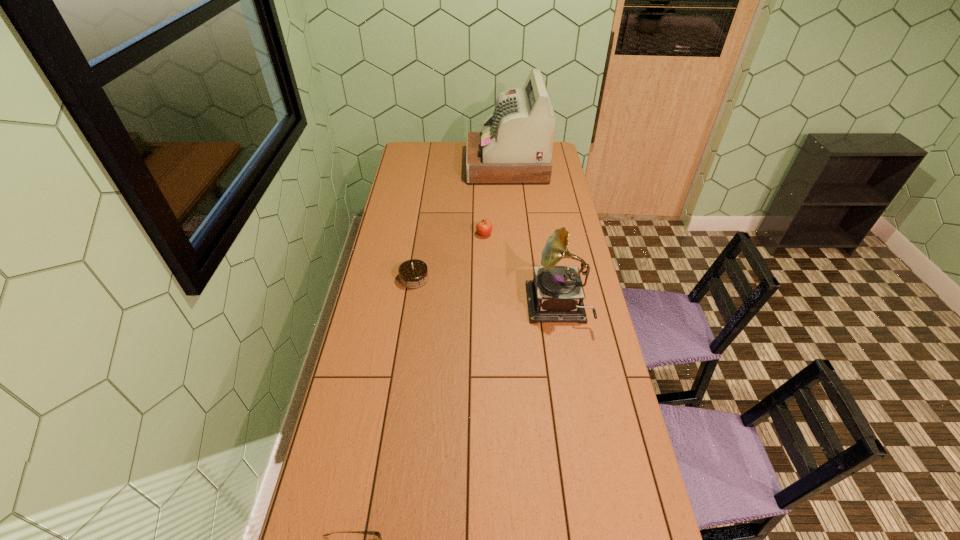
Where is `free space between the cash register and the second tallest object`? This screenshot has width=960, height=540. free space between the cash register and the second tallest object is located at coordinates (532, 237).

Locate an element on the screen. vacant area that lies between the chocolate cake and the tallest object is located at coordinates (461, 223).

This screenshot has height=540, width=960. I want to click on free space that is in between the record player and the chocolate cake, so click(486, 293).

Locate an element on the screen. This screenshot has width=960, height=540. empty space between the chocolate cake and the cash register is located at coordinates (461, 223).

Identify the location of vacant space that is in between the fourth shortest object and the apple. The height and width of the screenshot is (540, 960). (521, 271).

The width and height of the screenshot is (960, 540). What are the coordinates of `free area in between the second tallest object and the chocolate cake` in the screenshot? It's located at (486, 293).

You are a GUI agent. You are given a task and a screenshot of the screen. Output one action in this format:
    pyautogui.click(x=<x>, y=<y>)
    Task: Click on the free point between the apple and the chocolate cake
    
    Given the screenshot: What is the action you would take?
    pyautogui.click(x=449, y=256)

Choose which object is the nearest neighbor to the cash register. Please provide its 2D coordinates. Your answer should be formatted as a tuple, i.e. [(x, y)], where the tuple contains the x and y coordinates of a point satisfying the conditions above.

[(484, 227)]

Select which object is the second closest to the second tallest object. Please provide its 2D coordinates. Your answer should be formatted as a tuple, i.e. [(x, y)], where the tuple contains the x and y coordinates of a point satisfying the conditions above.

[(413, 274)]